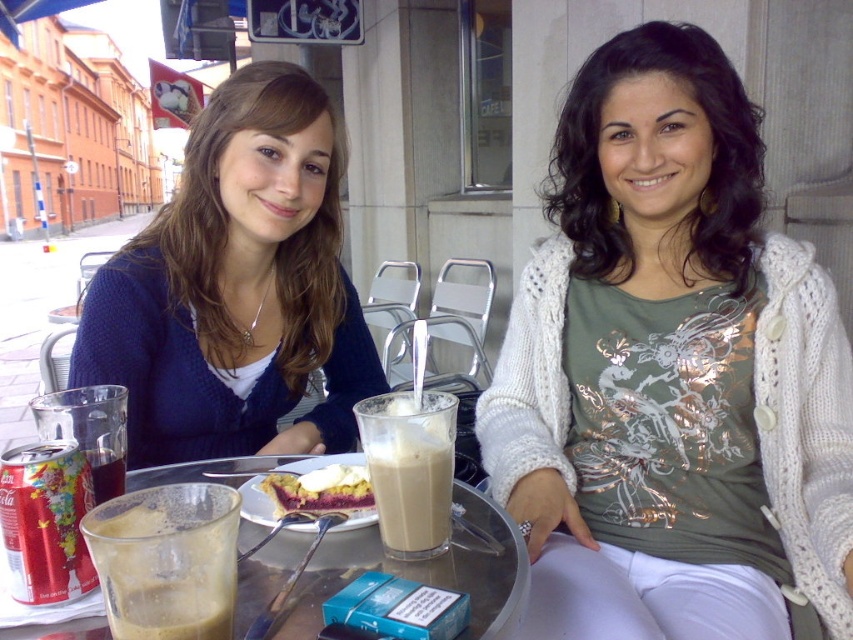
Does white knitted cardigan at center have a smaller size compared to dark brown liquid at lower left?

No.

Is white knitted cardigan at center to the left of dark brown liquid at lower left from the viewer's perspective?

Incorrect, white knitted cardigan at center is not on the left side of dark brown liquid at lower left.

Is point (706, 516) positioned before point (125, 474)?

No.

Locate an element on the screen. white knitted cardigan at center is located at coordinates (671, 371).

Can you confirm if transparent glass at center is positioned above translucent glass cup at lower left?

No, transparent glass at center is not above translucent glass cup at lower left.

Looking at this image, which is above, transparent glass at center or translucent glass cup at lower left?

translucent glass cup at lower left is above.

This screenshot has width=853, height=640. What are the coordinates of `transparent glass at center` in the screenshot? It's located at (421, 572).

Between milkshake-like liquid at center and dark brown liquid at lower left, which one has less height?

With less height is dark brown liquid at lower left.

Is point (396, 513) closer to camera compared to point (99, 481)?

Yes.

Where is `milkshake-like liquid at center`? The width and height of the screenshot is (853, 640). milkshake-like liquid at center is located at coordinates click(409, 468).